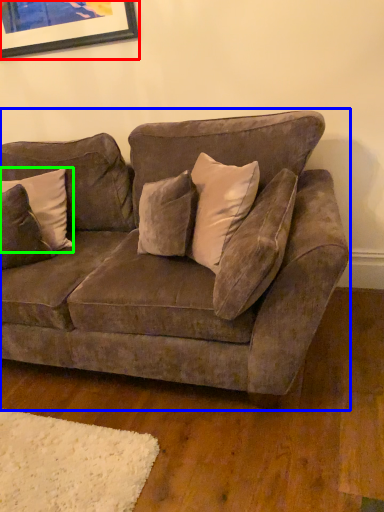
Question: Considering the real-world distances, which object is farthest from picture frame (highlighted by a red box)? studio couch (highlighted by a blue box) or pillow (highlighted by a green box)?

Choices:
 (A) studio couch
 (B) pillow

Answer: (A)